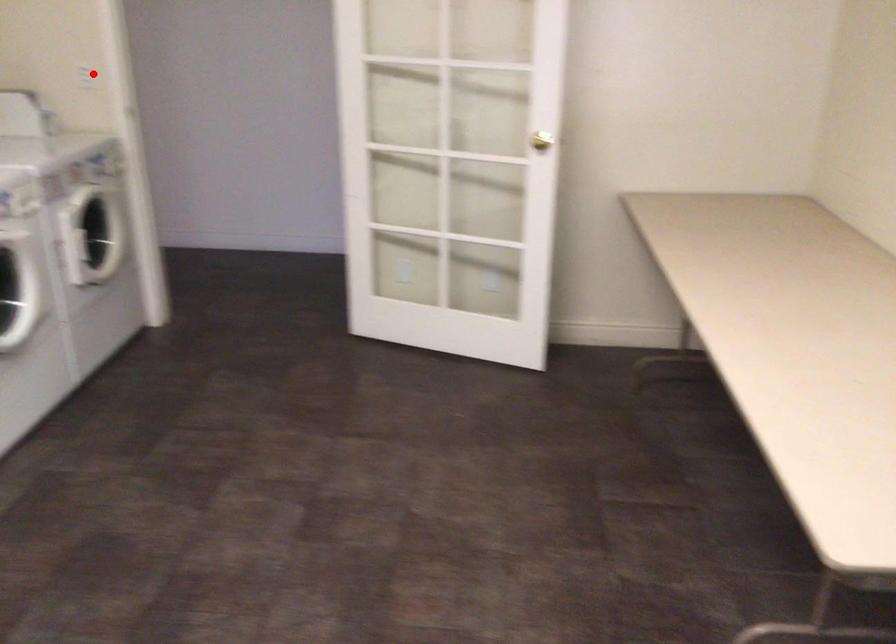
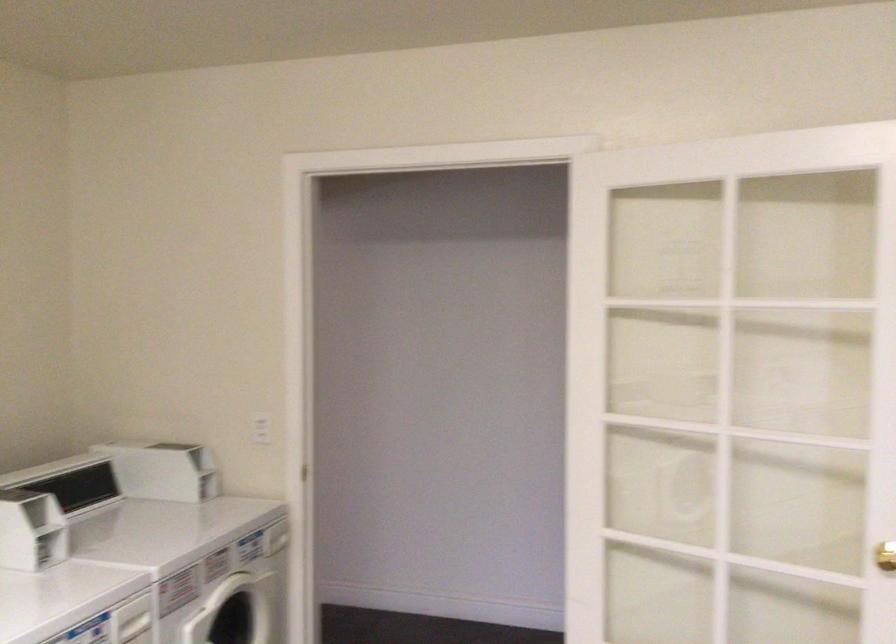
Question: I am providing you with two images of the same scene from different viewpoints. Given a red point in image1, look at the same physical point in image2. Is it:

Choices:
 (A) Closer to the viewpoint
 (B) Farther from the viewpoint

Answer: (A)